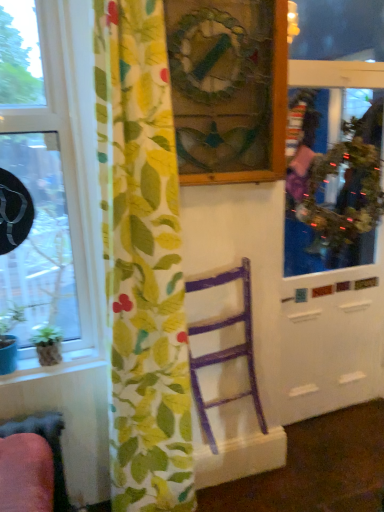
This screenshot has height=512, width=384. I want to click on blank area beneath wooden picture frame at upper center (from a real-world perspective), so click(x=223, y=254).